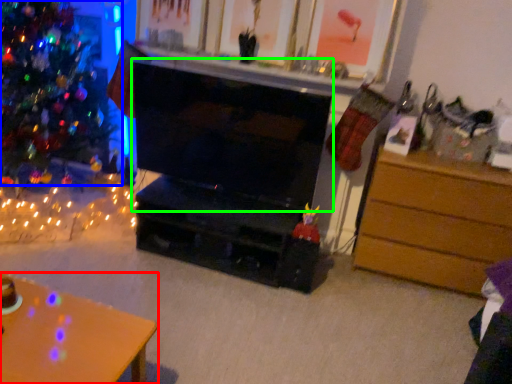
Question: Which is nearer to the desk (highlighted by a red box)? christmas tree (highlighted by a blue box) or fireplace (highlighted by a green box).

Choices:
 (A) christmas tree
 (B) fireplace

Answer: (B)